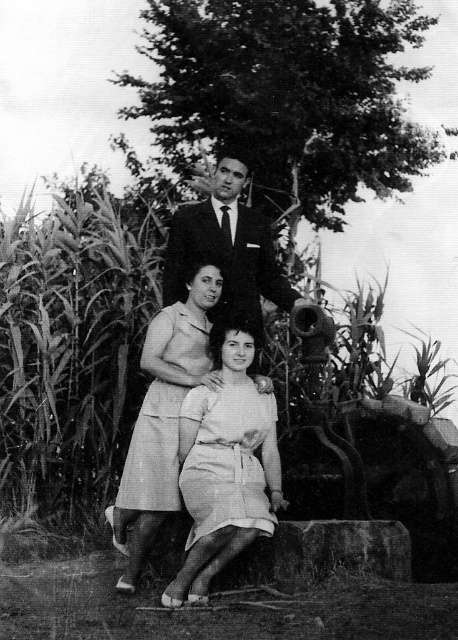
Question: Which of the following is the closest to the observer?

Choices:
 (A) smooth fabric dress at center
 (B) green leafy corn at upper left
 (C) light beige fabric dress at center
 (D) smooth black suit at center

Answer: (C)

Question: Which of the following is the farthest from the observer?

Choices:
 (A) (168, 396)
 (B) (203, 440)
 (C) (165, 456)

Answer: (A)

Question: Can you confirm if smooth fabric dress at center is positioned to the right of light beige fabric dress at center?

Choices:
 (A) no
 (B) yes

Answer: (A)

Question: Is smooth fabric dress at center in front of light beige cotton dress at center?

Choices:
 (A) yes
 (B) no

Answer: (B)

Question: Which point appears closest to the camera in this image?

Choices:
 (A) (206, 342)
 (B) (170, 474)
 (C) (262, 454)

Answer: (B)

Question: Can you confirm if light beige cotton dress at center is positioned below smooth black suit at center?

Choices:
 (A) no
 (B) yes

Answer: (B)